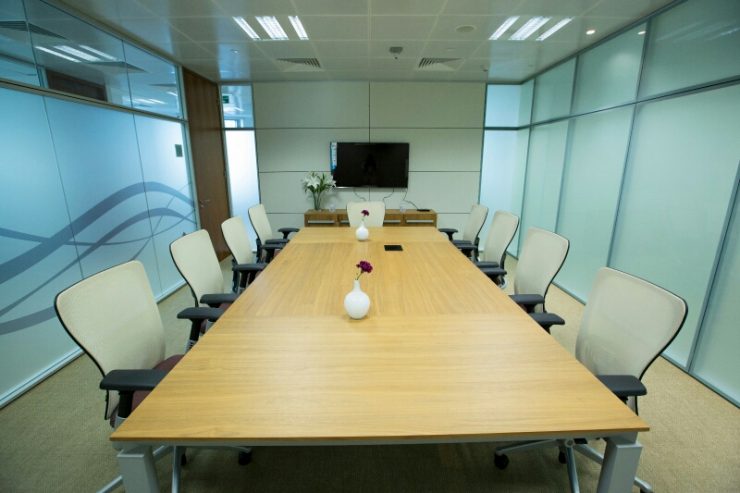
This screenshot has width=740, height=493. In order to click on transparent vase in this screenshot , I will do `click(317, 202)`.